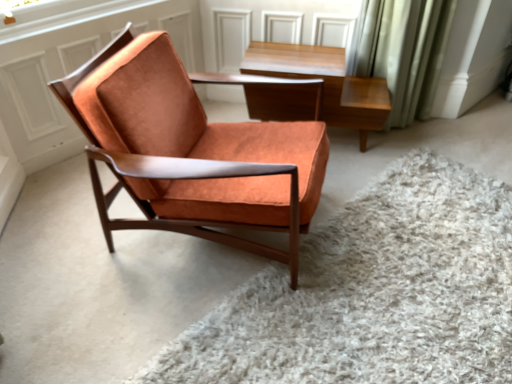
Question: From a real-world perspective, is orange suede chair at center physically located above or below suede orange chair at center?

Choices:
 (A) above
 (B) below

Answer: (B)

Question: Considering the positions of point (412, 309) and point (152, 56), is point (412, 309) closer or farther from the camera than point (152, 56)?

Choices:
 (A) closer
 (B) farther

Answer: (A)

Question: Estimate the real-world distances between objects in this image. Which object is closer to the orange suede chair at center?

Choices:
 (A) suede orange chair at center
 (B) light brown wood table at upper center

Answer: (A)

Question: Based on their relative distances, which object is farther from the light brown wood table at upper center?

Choices:
 (A) orange suede chair at center
 (B) suede orange chair at center

Answer: (A)